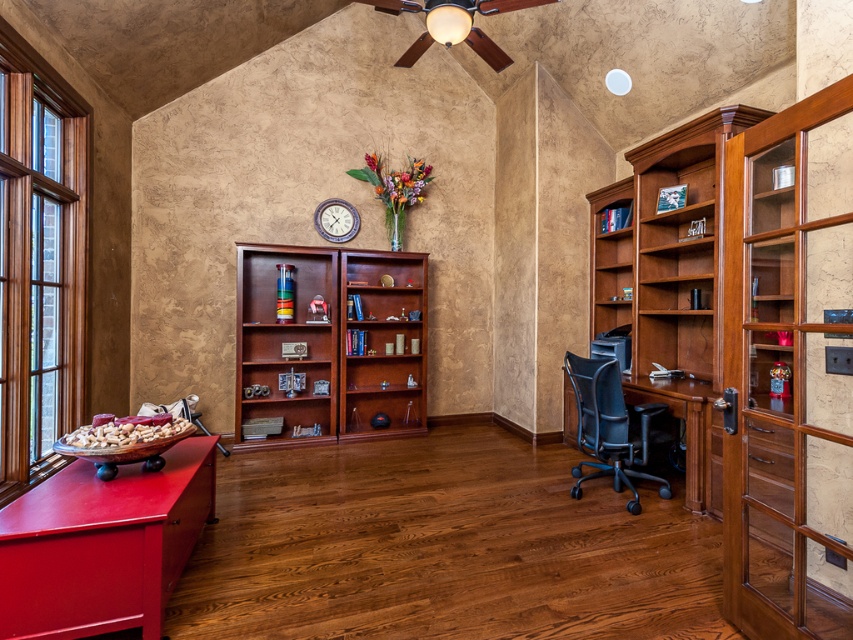
What do you see at coordinates (672, 282) in the screenshot? The width and height of the screenshot is (853, 640). I see `mahogany wood bookcase at right` at bounding box center [672, 282].

Which is behind, point (625, 236) or point (590, 364)?

The point (625, 236) is more distant.

Find the location of a particular element. The image size is (853, 640). mahogany wood bookcase at right is located at coordinates (672, 282).

Find the location of `mahogany wood bookcase at right`. mahogany wood bookcase at right is located at coordinates (672, 282).

Between cherry wood bookcase at center and black mesh swivel chair at lower right, which one has less height?

black mesh swivel chair at lower right is shorter.

Does point (373, 429) come farther from viewer compared to point (599, 422)?

Yes, point (373, 429) is behind point (599, 422).

You are a GUI agent. You are given a task and a screenshot of the screen. Output one action in this format:
    pyautogui.click(x=<x>, y=<y>)
    Task: Click on the cherry wood bookcase at center
    This screenshot has width=853, height=640.
    Given the screenshot: What is the action you would take?
    (x=334, y=340)

Is matte red cabinet at lower left to the left of cherry wood bookcase at center from the viewer's perspective?

Yes, matte red cabinet at lower left is to the left of cherry wood bookcase at center.

Which is in front, point (70, 484) or point (314, 284)?

Point (70, 484) is more forward.

Is point (42, 513) positioned in front of point (306, 337)?

Yes, point (42, 513) is closer to viewer.

Locate an element on the screen. This screenshot has height=640, width=853. matte red cabinet at lower left is located at coordinates (102, 545).